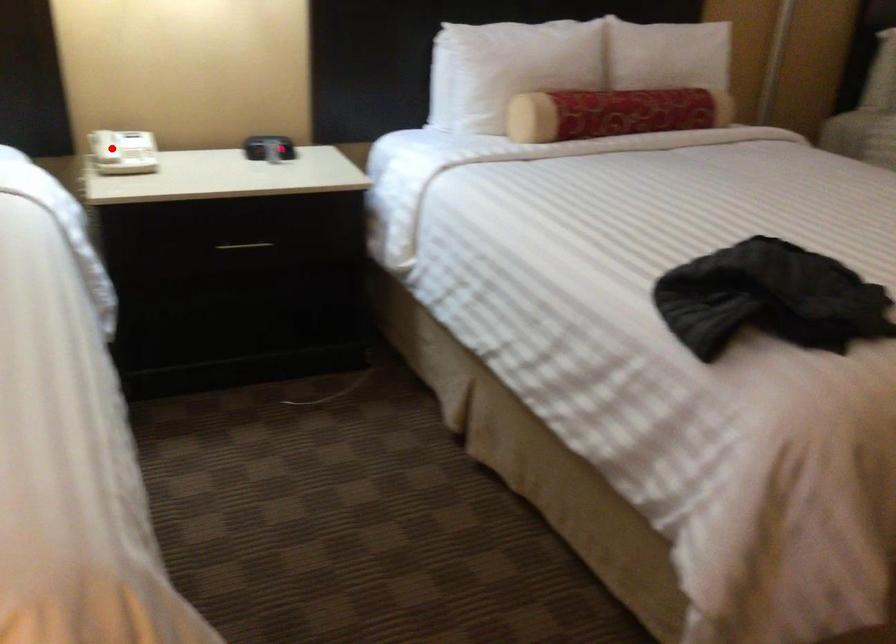
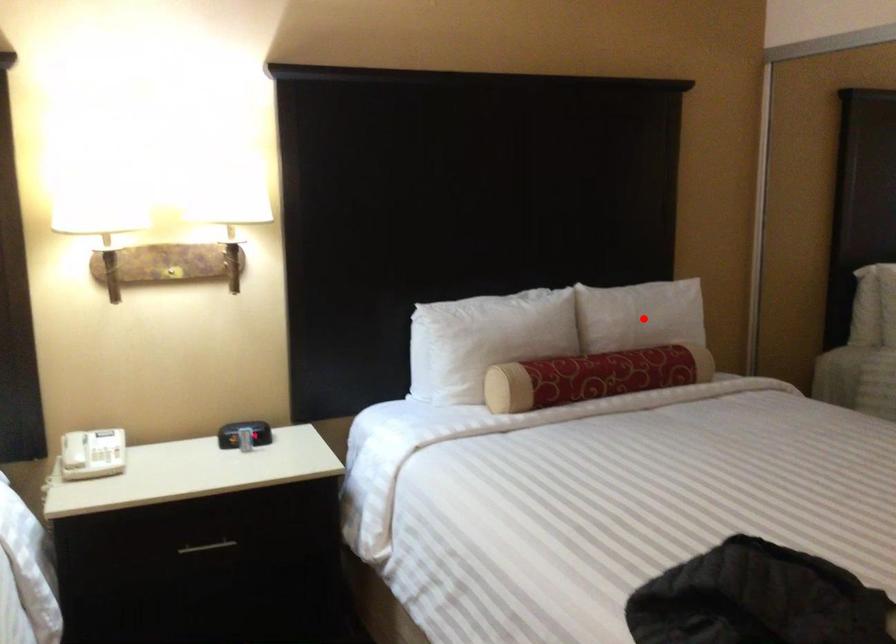
I am providing you with two images of the same scene from different viewpoints. A red point is marked on the first image and another point is marked on the second image. Does the point marked in image1 correspond to the same location as the one in image2?

No